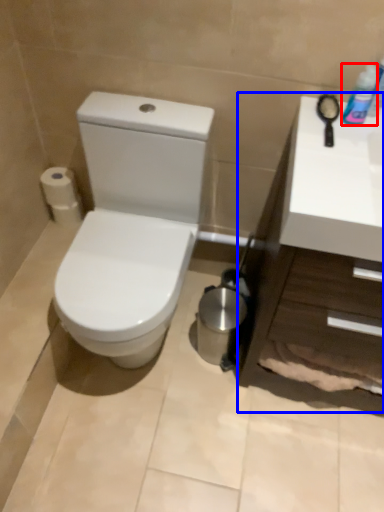
Question: Which point is closer to the camera, mouthwash (highlighted by a red box) or counter top (highlighted by a blue box)?

Choices:
 (A) mouthwash
 (B) counter top

Answer: (B)